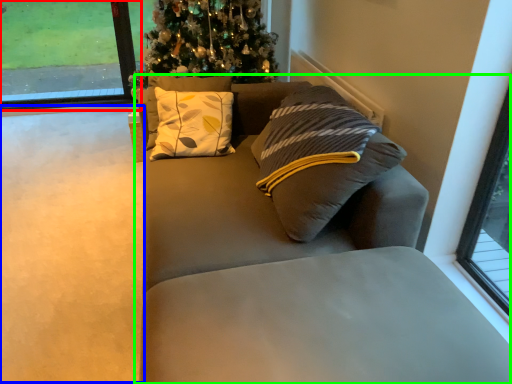
Question: Estimate the real-world distances between objects in this image. Which object is closer to window (highlighted by a red box), golf course (highlighted by a blue box) or studio couch (highlighted by a green box)?

Choices:
 (A) golf course
 (B) studio couch

Answer: (A)